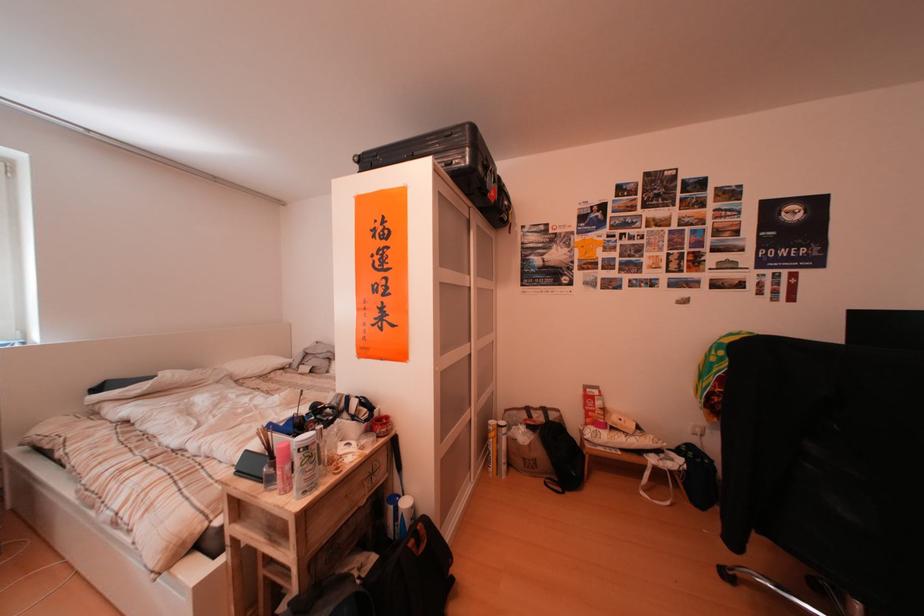
This screenshot has width=924, height=616. Find the location of `blue and white bottle`. blue and white bottle is located at coordinates point(398,514).